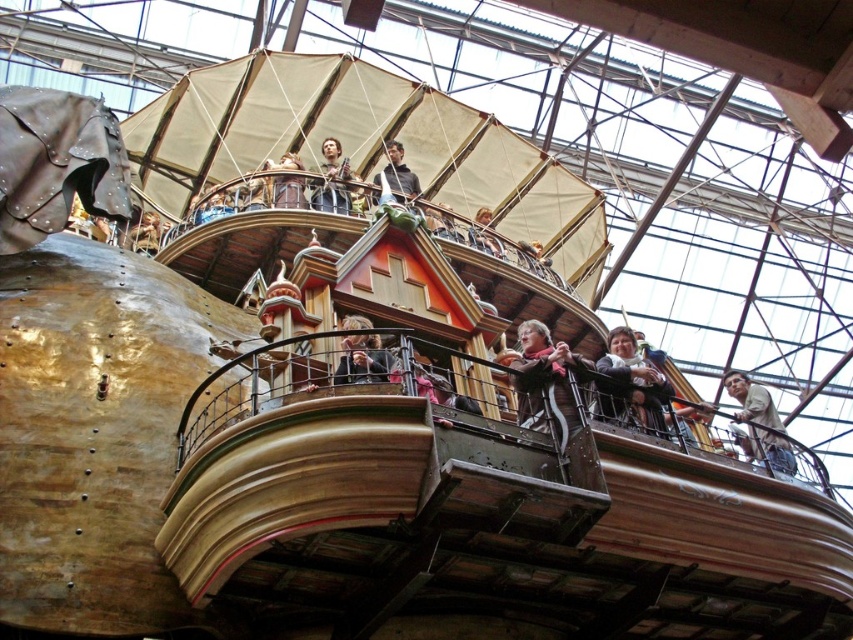
Question: Based on their relative distances, which object is farther from the matte black jacket at upper center?

Choices:
 (A) matte brown jacket at center
 (B) matte gray jacket at upper center
 (C) wooden figure at upper center
 (D) matte brown coat at center

Answer: (D)

Question: Which of the following is the farthest from the observer?

Choices:
 (A) matte brown jacket at lower right
 (B) matte brown coat at center

Answer: (A)

Question: Is matte brown jacket at lower right to the left of matte brown jacket at upper right from the viewer's perspective?

Choices:
 (A) no
 (B) yes

Answer: (B)

Question: Does matte brown coat at center have a larger size compared to golden metallic ship at upper center?

Choices:
 (A) no
 (B) yes

Answer: (B)

Question: Which point is farther from the camera taking this photo?

Choices:
 (A) (332, 179)
 (B) (352, 371)
 (C) (300, 180)

Answer: (A)

Question: Is matte brown jacket at center bigger than wooden figure at upper center?

Choices:
 (A) no
 (B) yes

Answer: (A)